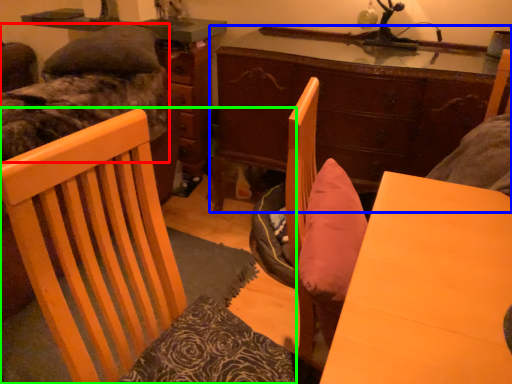
Question: Based on their relative distances, which object is farther from bed (highlighted by a red box)? Choose from desk (highlighted by a blue box) and chair (highlighted by a green box).

Choices:
 (A) desk
 (B) chair

Answer: (B)